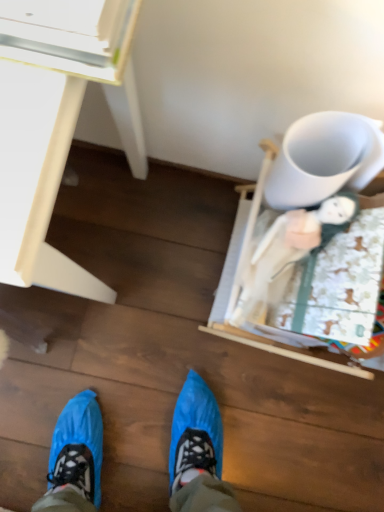
You are a GUI agent. You are given a task and a screenshot of the screen. Output one action in this format:
    pyautogui.click(x=<x>, y=<y>)
    Task: Click on the vacant space in front of white glossy desk at upper left
    The image size is (384, 512).
    Given the screenshot: What is the action you would take?
    pyautogui.click(x=81, y=376)